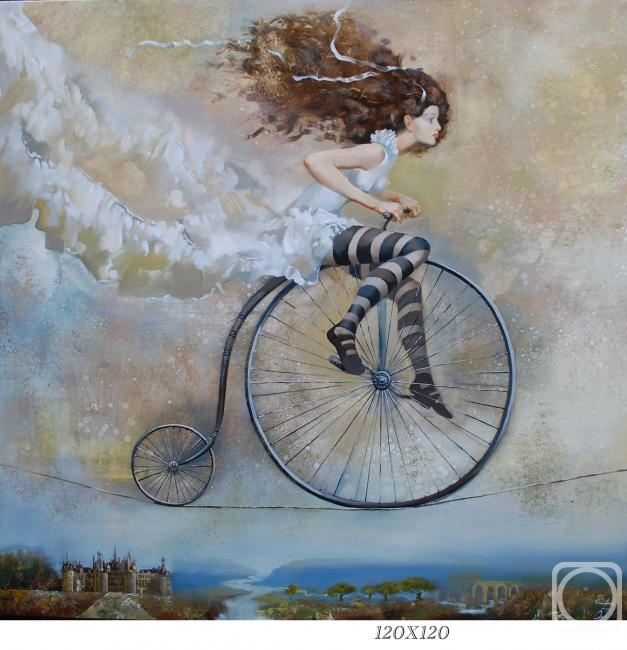
The width and height of the screenshot is (627, 650). Identify the location of painting. (381, 166).